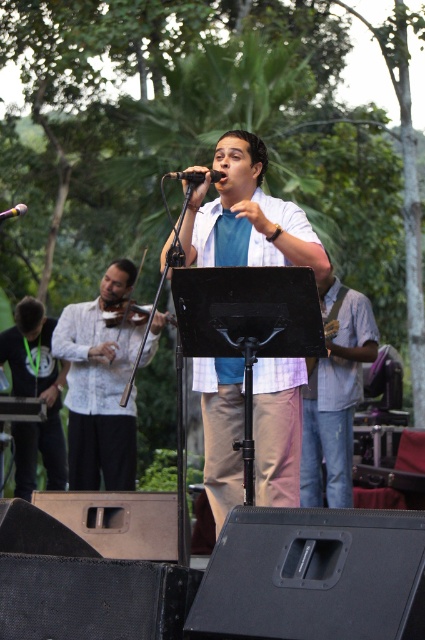
Question: Among these objects, which one is nearest to the camera?

Choices:
 (A) white textured shirt at center
 (B) black matte microphone at center

Answer: (B)

Question: Is the position of white textured shirt at center less distant than that of yellow and black plastic microphone at upper left?

Choices:
 (A) no
 (B) yes

Answer: (A)

Question: Which of the following is the closest to the observer?

Choices:
 (A) (322, 428)
 (B) (78, 429)
 (C) (36, 352)

Answer: (A)

Question: Which of these objects is positioned closest to the black matte microphone at center?

Choices:
 (A) yellow and black plastic microphone at upper left
 (B) black matte shirt at left

Answer: (A)

Question: Can you confirm if light blue shirt at center is positioned below yellow and black plastic microphone at upper left?

Choices:
 (A) yes
 (B) no

Answer: (A)

Question: Can you confirm if black matte shirt at left is bigger than yellow and black plastic microphone at upper left?

Choices:
 (A) no
 (B) yes

Answer: (A)